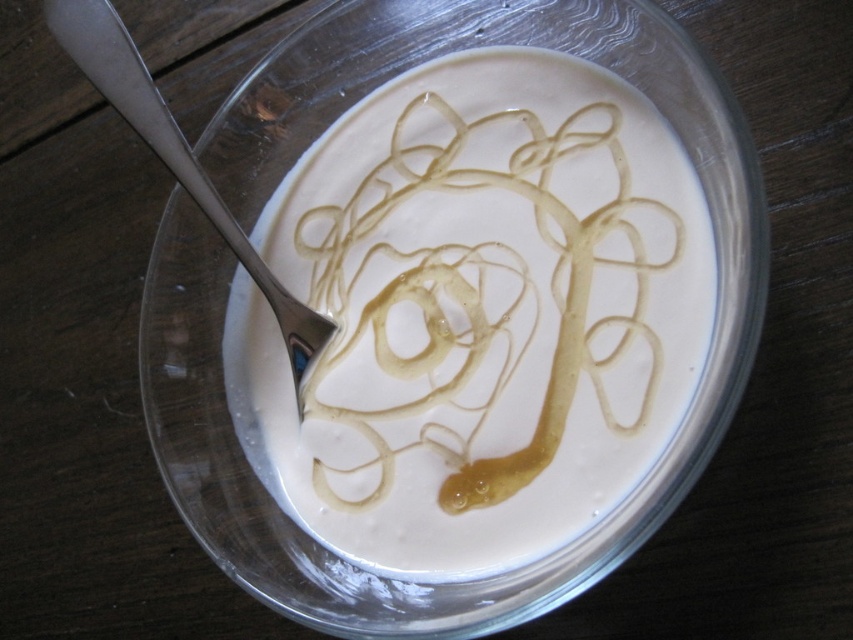
You are looking at a dessert arrangement. The transparent glass bowl at center is located at point (x=247, y=284). Can you determine the coordinates of the transparent glass bowl at center?

The transparent glass bowl at center is located at point (x=247, y=284).